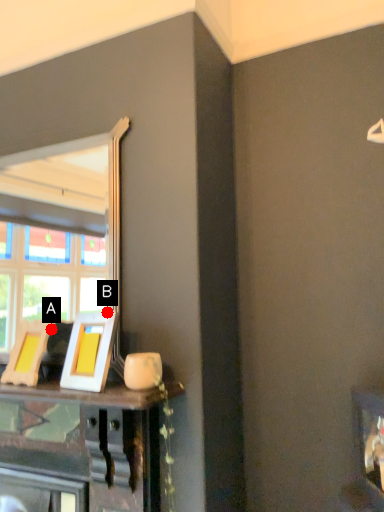
Question: Two points are circled on the image, labeled by A and B beside each circle. Among these points, which one is nearest to the camera?

Choices:
 (A) A is closer
 (B) B is closer

Answer: (B)